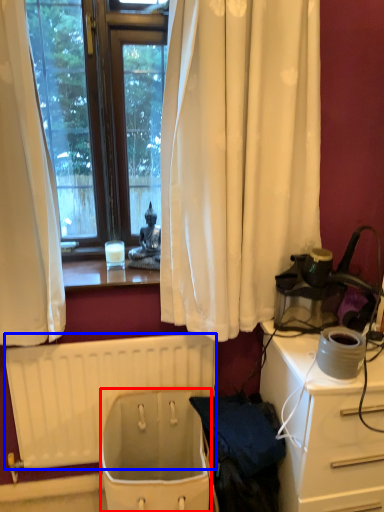
Question: Which object appears closest to the camera in this image, toilet bowl (highlighted by a red box) or radiator (highlighted by a blue box)?

Choices:
 (A) toilet bowl
 (B) radiator

Answer: (A)